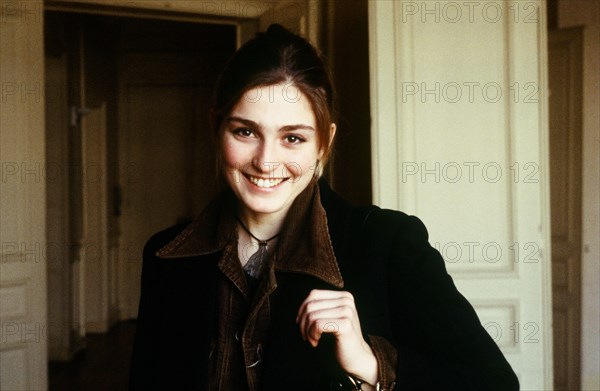
Where is `coat`? The image size is (600, 391). coat is located at coordinates (381, 267).